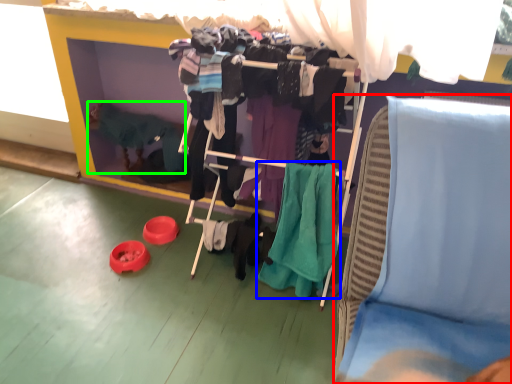
Question: Which is farther away from furniture (highlighted by a red box)? clothing (highlighted by a blue box) or person (highlighted by a green box)?

Choices:
 (A) clothing
 (B) person

Answer: (B)